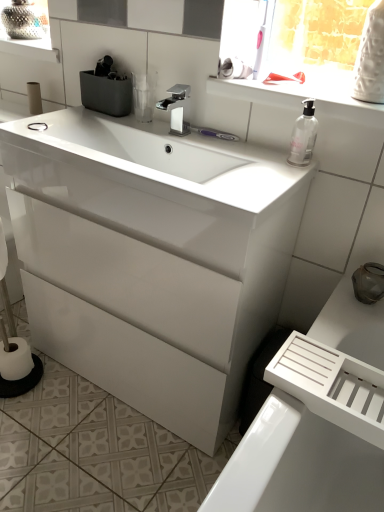
At what (x,y) coordinates should I click in order to perform the action: click on spots to the right of white matte toilet paper at lower left, the 1th toilet paper in the left-to-right sequence. Please return your answer as a coordinate pair (x, y). Looking at the image, I should click on (53, 386).